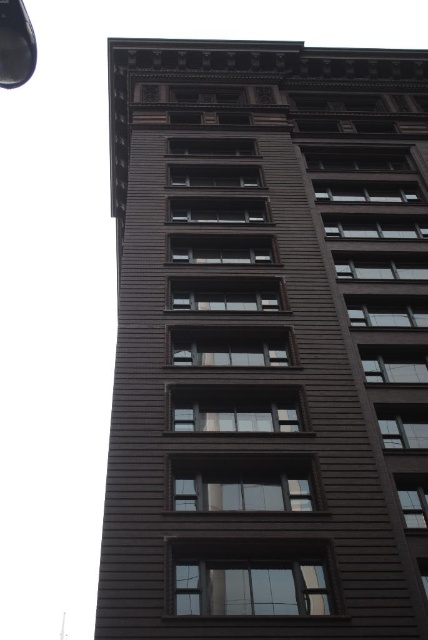
Does brown wood grain building at center appear over shiny black lamp post at upper left?

Correct, brown wood grain building at center is located above shiny black lamp post at upper left.

Is brown wood grain building at center shorter than shiny black lamp post at upper left?

Incorrect, brown wood grain building at center's height does not fall short of shiny black lamp post at upper left's.

Which is behind, point (246, 371) or point (26, 22)?

The point (246, 371) is behind.

Locate an element on the screen. The height and width of the screenshot is (640, 428). brown wood grain building at center is located at coordinates (267, 342).